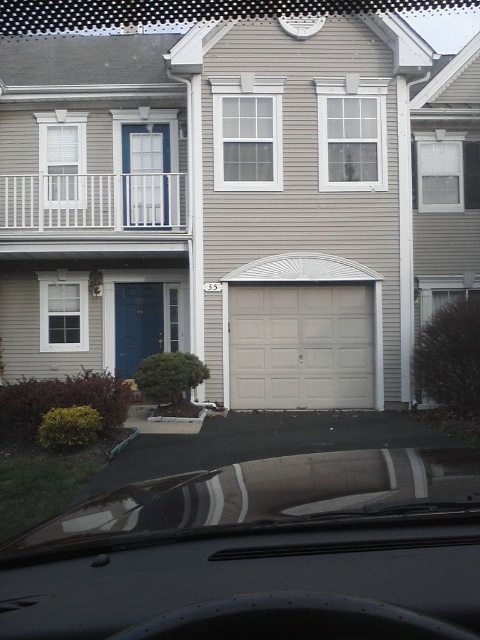
You are driving towards the house and need to check your speed using the dashboard. Can you easily see the speedometer on the black matte dashboard at lower center while looking through the transparent glass windshield at center?

The black matte dashboard at lower center is closer to the viewer than the transparent glass windshield at center, so yes, the speedometer on the black matte dashboard at lower center can be easily seen without obstruction from the windshield.

You are driving towards the house and want to see the house number 35 clearly through the transparent glass windshield at center. Since the white smooth garage door at center is in the way, will you be able to see the house number 35 through the windshield?

The transparent glass windshield at center is larger in size than the white smooth garage door at center, so yes, you can see the house number 35 through the windshield as the garage door does not fully block the view.